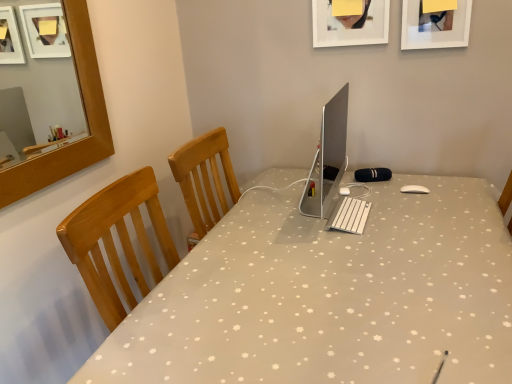
Question: From a real-world perspective, is matte white picture frame at upper center, the 2th picture frame from the right, located beneath silver metallic computer monitor at center?

Choices:
 (A) yes
 (B) no

Answer: (B)

Question: Is matte white picture frame at upper center, the 2th picture frame from the right, oriented towards silver metallic computer monitor at center?

Choices:
 (A) no
 (B) yes

Answer: (A)

Question: Can you confirm if matte white picture frame at upper center, the 2th picture frame from the right, is positioned to the left of silver metallic computer monitor at center?

Choices:
 (A) no
 (B) yes

Answer: (A)

Question: From a real-world perspective, is matte white picture frame at upper center, the 2th picture frame from the right, on top of silver metallic computer monitor at center?

Choices:
 (A) no
 (B) yes

Answer: (B)

Question: Is the surface of matte white picture frame at upper center, which is the first picture frame in left-to-right order, in direct contact with silver metallic computer monitor at center?

Choices:
 (A) yes
 (B) no

Answer: (B)

Question: From the image's perspective, is matte white picture frame at upper center, which is the first picture frame in left-to-right order, above silver metallic computer monitor at center?

Choices:
 (A) yes
 (B) no

Answer: (A)

Question: Is silver metallic computer monitor at center aimed at matte white picture frame at upper center, which is the first picture frame in left-to-right order?

Choices:
 (A) yes
 (B) no

Answer: (B)

Question: Does silver metallic computer monitor at center have a smaller size compared to matte white picture frame at upper center, which is the first picture frame in left-to-right order?

Choices:
 (A) yes
 (B) no

Answer: (B)

Question: Is silver metallic computer monitor at center shorter than matte white picture frame at upper center, which is the first picture frame in left-to-right order?

Choices:
 (A) yes
 (B) no

Answer: (B)

Question: Considering the relative positions of silver metallic computer monitor at center and matte white picture frame at upper center, which is the first picture frame in left-to-right order, in the image provided, is silver metallic computer monitor at center behind matte white picture frame at upper center, which is the first picture frame in left-to-right order,?

Choices:
 (A) no
 (B) yes

Answer: (A)

Question: From the image's perspective, is silver metallic computer monitor at center over matte white picture frame at upper center, the 2th picture frame from the right?

Choices:
 (A) no
 (B) yes

Answer: (A)

Question: Is silver metallic computer monitor at center positioned in front of matte white picture frame at upper center, which is the first picture frame in left-to-right order?

Choices:
 (A) yes
 (B) no

Answer: (A)

Question: Is white matte picture frame at upper right, the 2th picture frame positioned from the left, positioned beyond the bounds of white fabric desk at center?

Choices:
 (A) no
 (B) yes

Answer: (B)